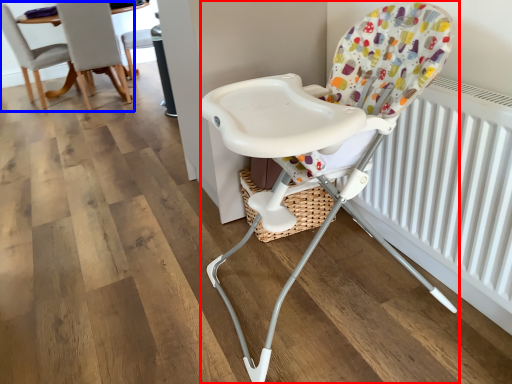
Question: Among these objects, which one is nearest to the camera, chair (highlighted by a red box) or chair (highlighted by a blue box)?

Choices:
 (A) chair
 (B) chair

Answer: (A)